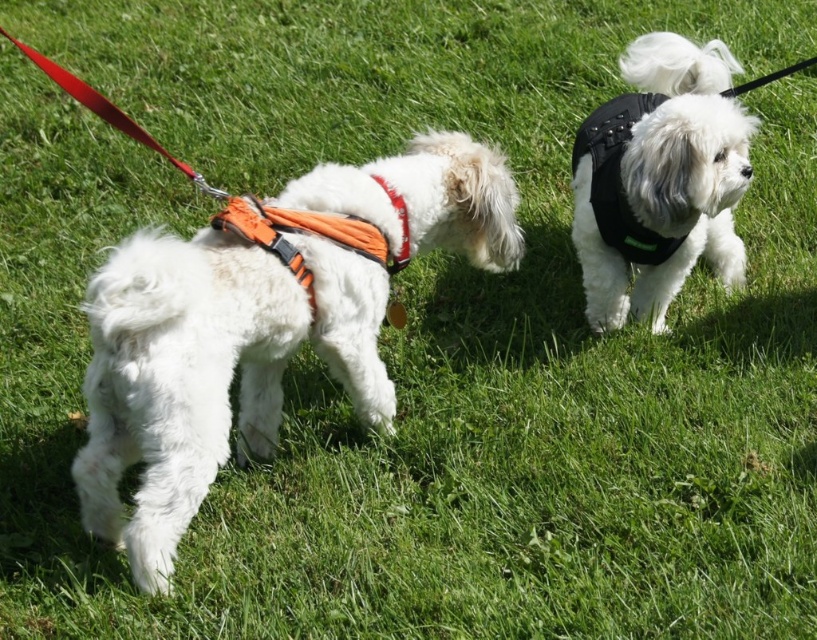
Who is positioned more to the right, black matte vest at upper right or orange fabric neckband at center?

Positioned to the right is black matte vest at upper right.

Who is positioned more to the left, black matte vest at upper right or orange fabric neckband at center?

orange fabric neckband at center is more to the left.

Find the location of a particular element. The image size is (817, 640). black matte vest at upper right is located at coordinates (668, 180).

Is white soft fur dog at left bigger than black matte vest at upper right?

Correct, white soft fur dog at left is larger in size than black matte vest at upper right.

Which is in front, point (489, 148) or point (655, 90)?

Point (655, 90) is in front.

Does point (436, 224) come behind point (715, 221)?

No.

Find the location of a particular element. white soft fur dog at left is located at coordinates (208, 371).

Who is more forward, (x=355, y=278) or (x=404, y=205)?

Positioned in front is point (x=355, y=278).

The width and height of the screenshot is (817, 640). I want to click on white soft fur dog at left, so click(x=208, y=371).